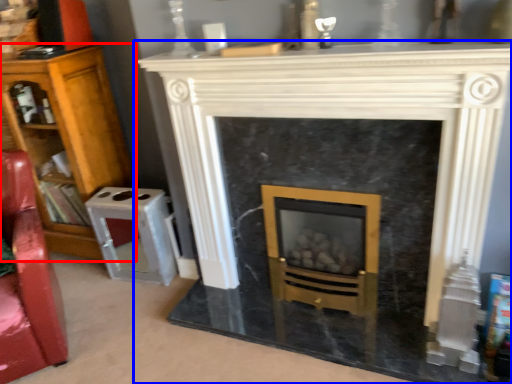
Question: Among these objects, which one is nearest to the camera, bookcase (highlighted by a red box) or fireplace (highlighted by a blue box)?

Choices:
 (A) bookcase
 (B) fireplace

Answer: (B)